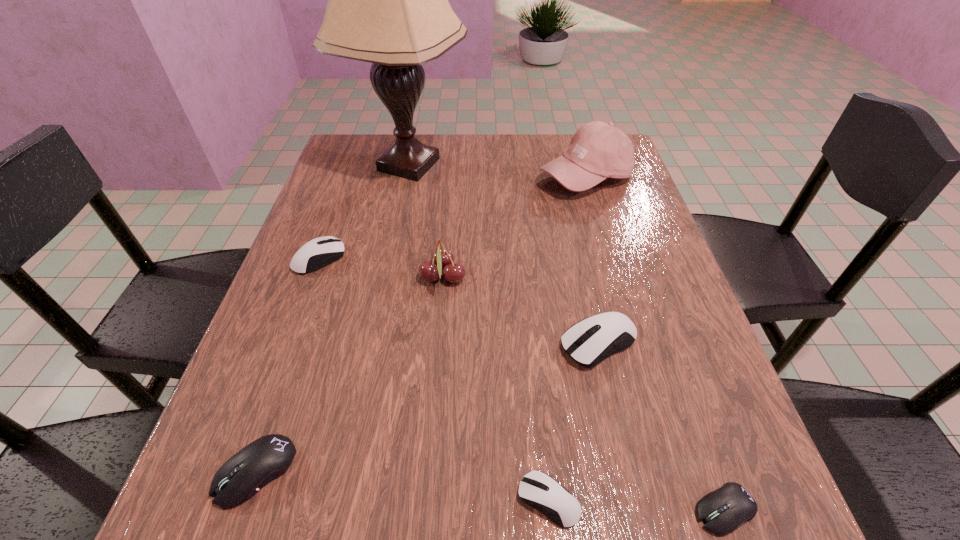
You are a GUI agent. You are given a task and a screenshot of the screen. Output one action in this format:
    pyautogui.click(x=<x>, y=<y>)
    Task: Click on the free location located 0.140m on the right of the bigger black computer equipment
    Image resolution: width=960 pixels, height=540 pixels.
    Given the screenshot: What is the action you would take?
    pyautogui.click(x=388, y=471)

This screenshot has height=540, width=960. What are the coordinates of `vacant space located on the back of the nearest white mouse` in the screenshot? It's located at (529, 305).

The width and height of the screenshot is (960, 540). I want to click on free region located on the back of the smaller black computer equipment, so click(688, 407).

Find the location of a particular element. The height and width of the screenshot is (540, 960). lamp at the far edge is located at coordinates (388, 4).

You are a GUI agent. You are given a task and a screenshot of the screen. Output one action in this format:
    pyautogui.click(x=<x>, y=<y>)
    Task: Click on the baseball cap that is at the far edge
    The image size is (960, 540).
    Given the screenshot: What is the action you would take?
    pyautogui.click(x=598, y=150)

Locate an element on the screen. This screenshot has width=960, height=540. lamp positioned at the left edge is located at coordinates (388, 4).

At what (x,y) coordinates should I click in order to perform the action: click on baseball cap at the right edge. Please return your answer as a coordinate pair (x, y). The width and height of the screenshot is (960, 540). Looking at the image, I should click on (598, 150).

This screenshot has width=960, height=540. What are the coordinates of `object that is at the far left corner` in the screenshot? It's located at (388, 4).

Locate an element on the screen. object that is at the near left corner is located at coordinates (262, 461).

Where is `object positioned at the far right corner`? The width and height of the screenshot is (960, 540). object positioned at the far right corner is located at coordinates (598, 150).